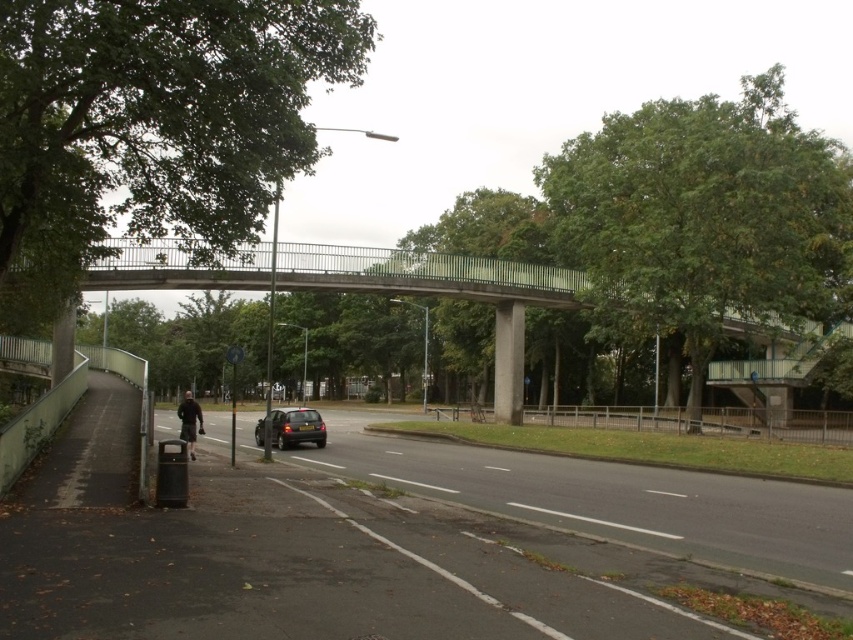
Question: In this image, where is green metallic bridge at center located relative to shiny black car at center?

Choices:
 (A) below
 (B) above

Answer: (B)

Question: Among these points, which one is farthest from the camera?

Choices:
 (A) (424, 397)
 (B) (311, 408)

Answer: (A)

Question: Can you confirm if green metallic bridge at center is smaller than shiny black car at center?

Choices:
 (A) no
 (B) yes

Answer: (A)

Question: Can you confirm if green metallic bridge at center is positioned below shiny black car at center?

Choices:
 (A) yes
 (B) no

Answer: (B)

Question: Which point appears closest to the camera in this image?

Choices:
 (A) (285, 436)
 (B) (54, 378)

Answer: (A)